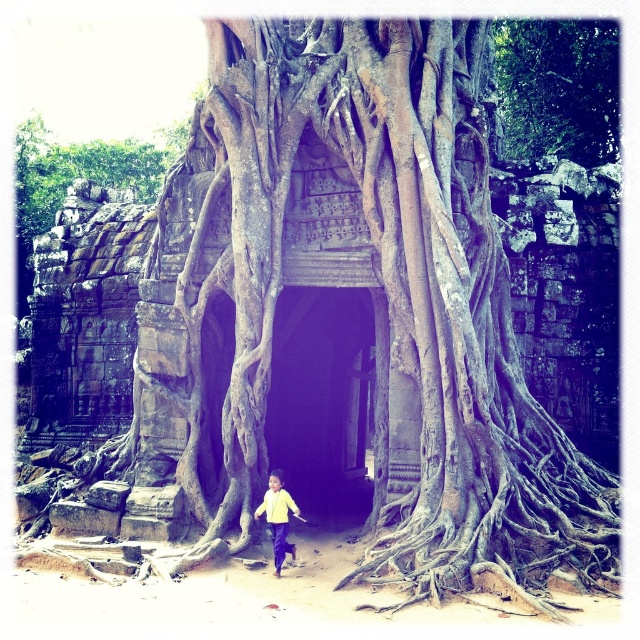
You are standing at the point labeled point [58,147] and want to walk to the point labeled point [260,509]. Given the dense roots and stone structure in the scene, will you have to go around any obstacles along the way?

Yes, you will have to go around the dense roots and stone structure between point [58,147] and point [260,509] since point [58,147] is behind point [260,509] and the roots and structure may block the direct path.

You are standing at the center of the stone doorway in the image. Looking up, you notice a point marked at coordinates (557, 88). What object is located at that point?

The point at (557, 88) is occupied by the green leafy tree at upper center.